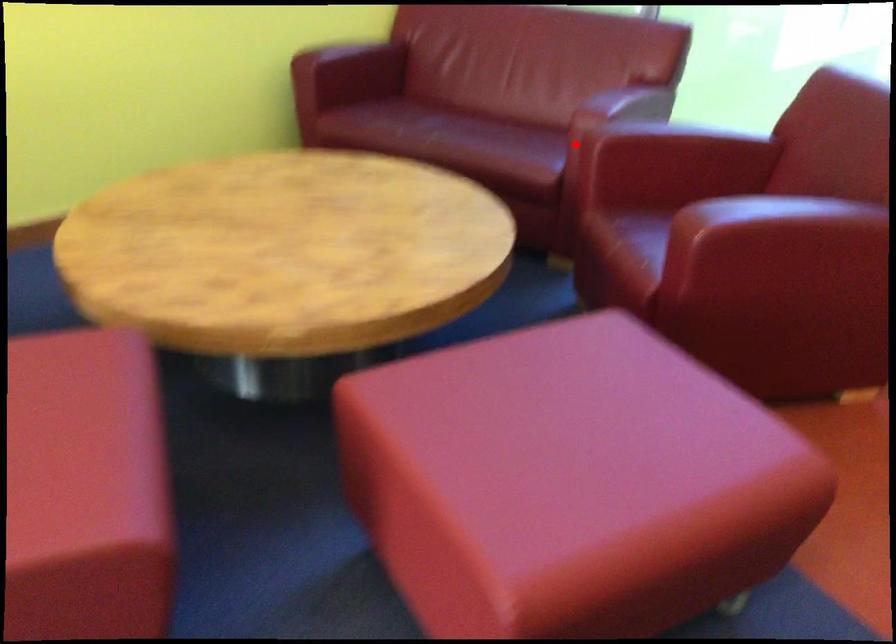
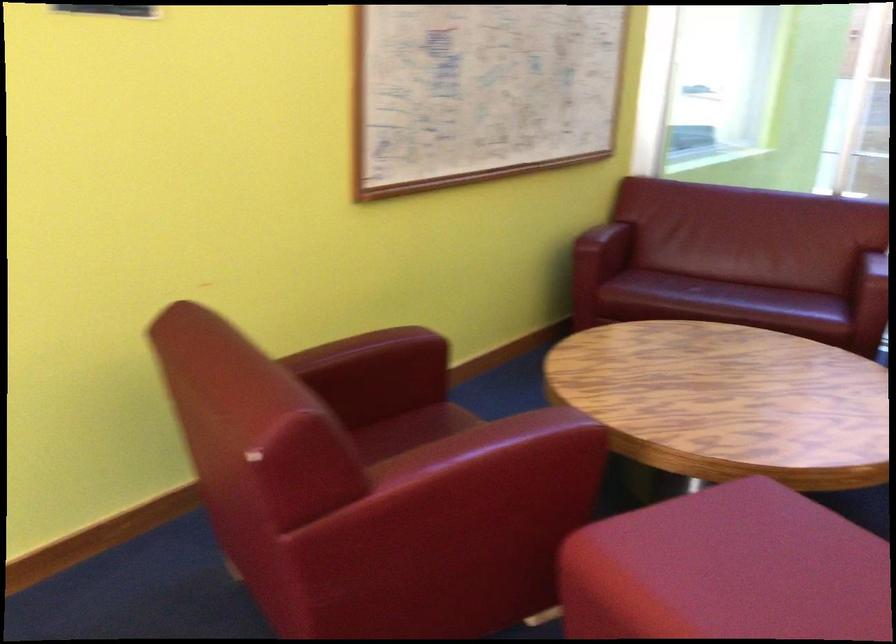
Find the pixel in the second image that matches the highlighted location in the first image.

(872, 306)